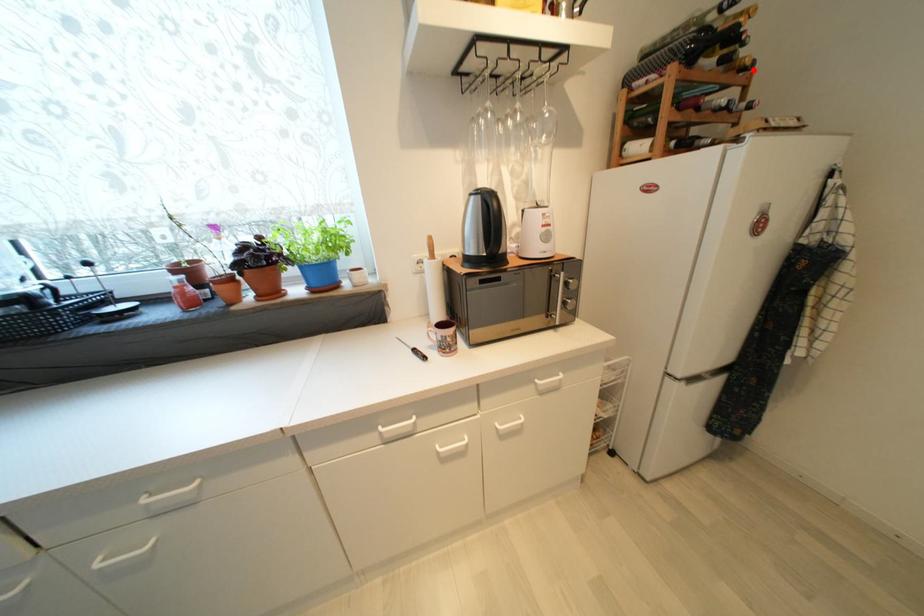
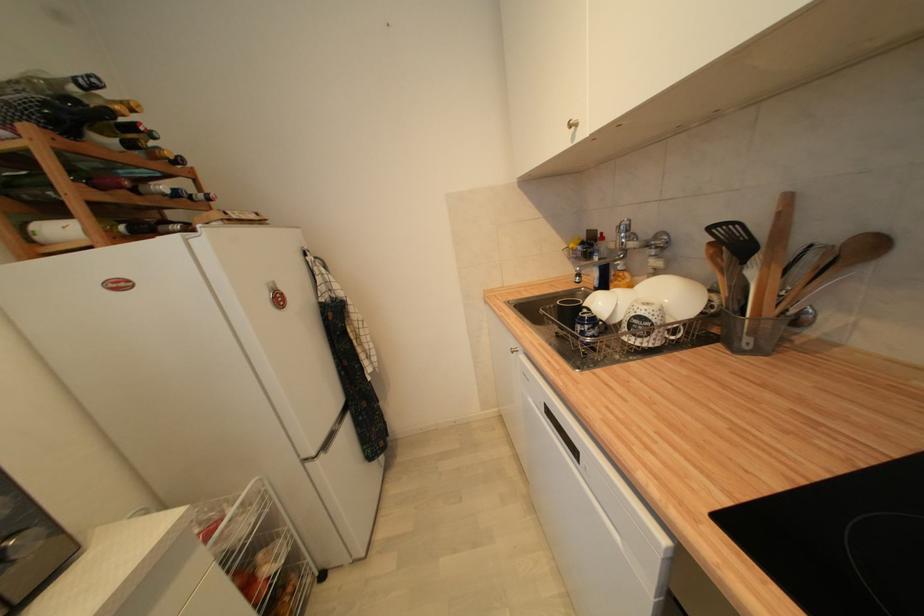
Question: I am providing you with two images of the same scene from different viewpoints. A red point is marked on the first image. Is the red point's position out of view in image 2?

Choices:
 (A) Yes
 (B) No

Answer: (B)